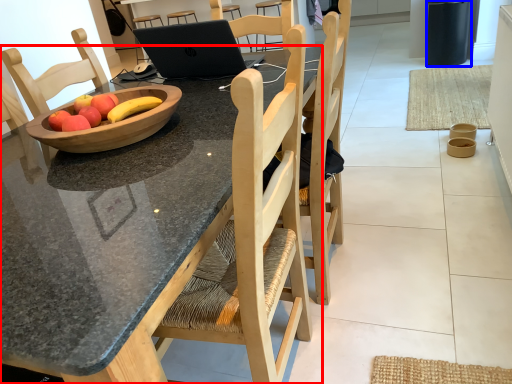
Question: Among these objects, which one is nearest to the camera, desk (highlighted by a red box) or trash bin/can (highlighted by a blue box)?

Choices:
 (A) desk
 (B) trash bin/can

Answer: (A)